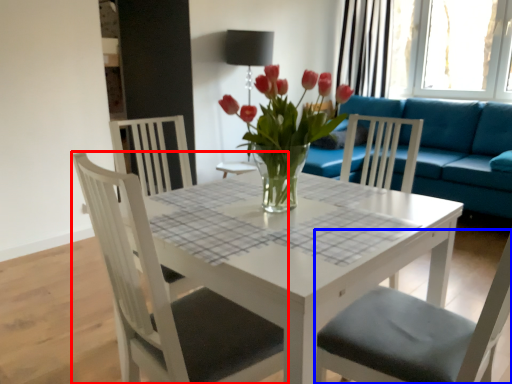
Question: Among these objects, which one is nearest to the camera, chair (highlighted by a red box) or chair (highlighted by a blue box)?

Choices:
 (A) chair
 (B) chair

Answer: (B)